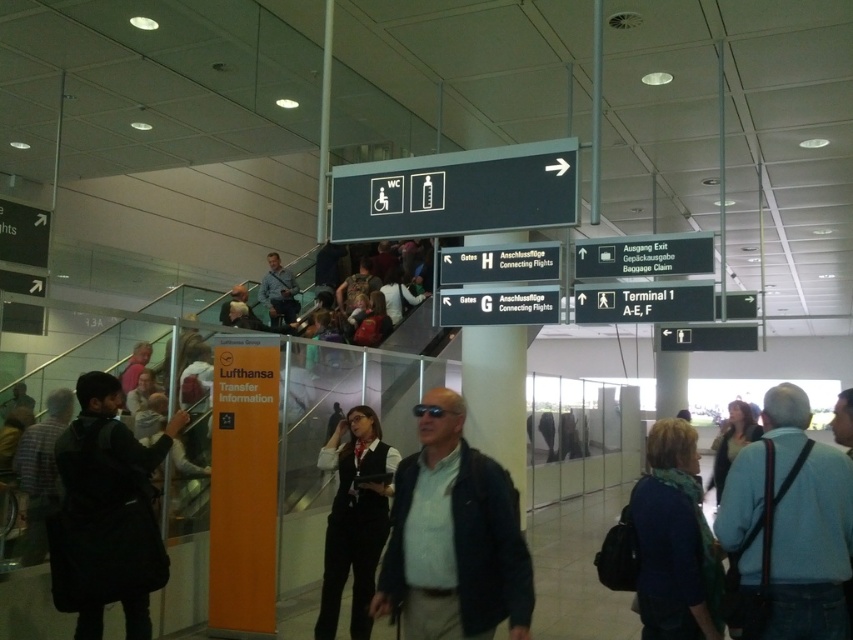
Can you confirm if light blue shirt at center is smaller than light blue shirt at upper center?

Correct, light blue shirt at center occupies less space than light blue shirt at upper center.

Between light blue shirt at center and light blue shirt at upper center, which one is positioned higher?

light blue shirt at upper center is above.

Identify the location of light blue shirt at center. This screenshot has width=853, height=640. click(x=454, y=536).

Who is more forward, [502,486] or [424,204]?

Point [502,486]

Which is behind, point (432, 529) or point (437, 212)?

Positioned behind is point (437, 212).

You are a GUI agent. You are given a task and a screenshot of the screen. Output one action in this format:
    pyautogui.click(x=<x>, y=<y>)
    Task: Click on the light blue shirt at center
    
    Given the screenshot: What is the action you would take?
    pyautogui.click(x=454, y=536)

Who is shorter, blue fabric shirt at center or dark blue sweater at lower right?

With less height is blue fabric shirt at center.

Between point (751, 449) and point (659, 474), which one is positioned behind?

Positioned behind is point (659, 474).

The width and height of the screenshot is (853, 640). Identify the location of blue fabric shirt at center. (787, 529).